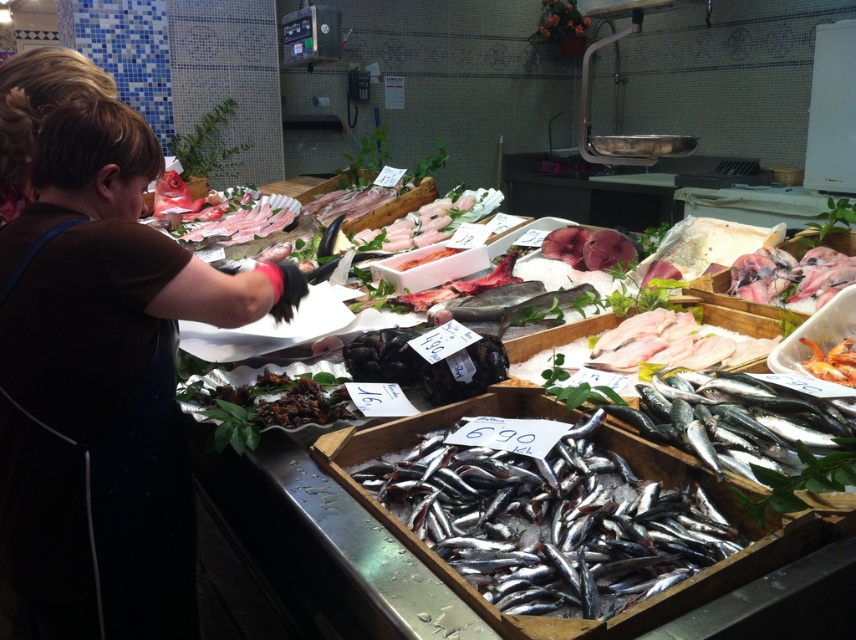
Can you confirm if brown fabric at left is taller than shiny orange shrimp at center?

Correct, brown fabric at left is much taller as shiny orange shrimp at center.

Can you confirm if brown fabric at left is positioned above shiny orange shrimp at center?

Actually, brown fabric at left is below shiny orange shrimp at center.

Who is more distant from viewer, (88,609) or (807,342)?

Point (807,342)

At what (x,y) coordinates should I click in order to perform the action: click on brown fabric at left. Please return your answer as a coordinate pair (x, y). Image resolution: width=856 pixels, height=640 pixels. Looking at the image, I should click on (103, 385).

Which is more to the right, shiny silver fish at center or shiny orange shrimp at center?

shiny orange shrimp at center

Measure the distance between shiny silver fish at center and shiny orange shrimp at center.

shiny silver fish at center is 95.05 centimeters away from shiny orange shrimp at center.

Is point (520, 472) farther from camera compared to point (809, 362)?

No, (520, 472) is closer to viewer.

At what (x,y) coordinates should I click in order to perform the action: click on shiny silver fish at center. Please return your answer as a coordinate pair (x, y). The width and height of the screenshot is (856, 640). Looking at the image, I should click on (550, 522).

Does brown fabric at left appear over shiny silver fish at center?

Correct, brown fabric at left is located above shiny silver fish at center.

Does point (75, 632) lie behind point (563, 436)?

No.

Which is in front, point (116, 330) or point (681, 547)?

Point (681, 547)

The width and height of the screenshot is (856, 640). I want to click on brown fabric at left, so click(103, 385).